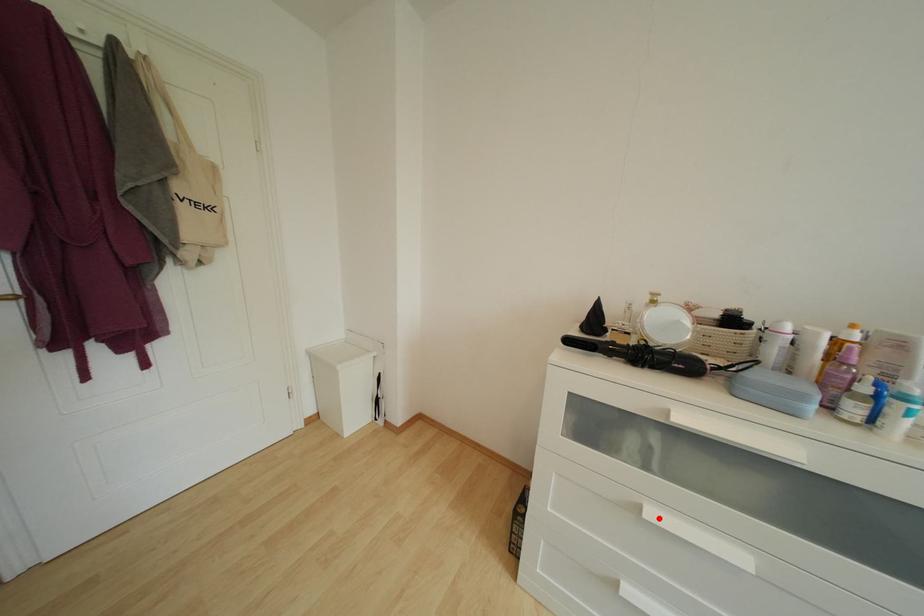
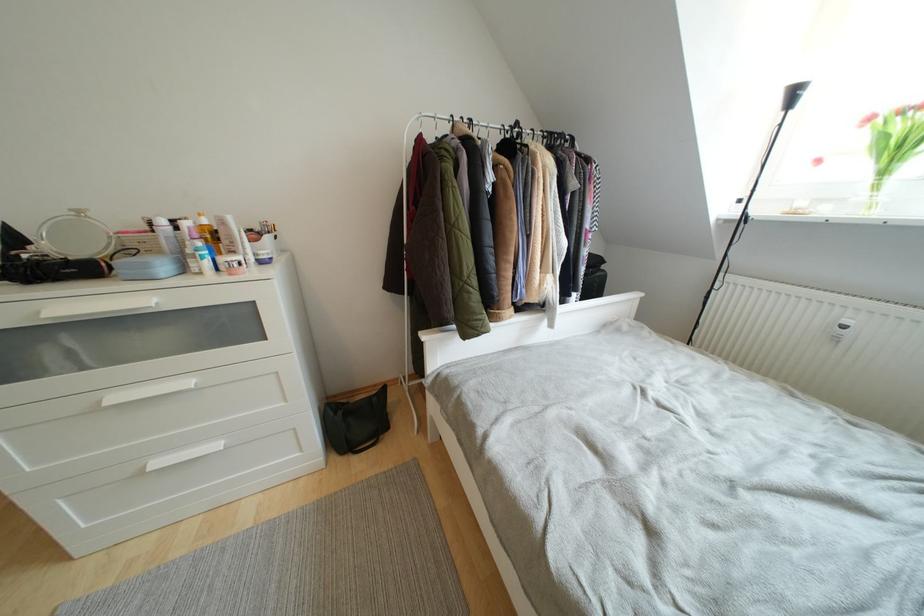
The point at the highlighted location is marked in the first image. Where is the corresponding point in the second image?

(120, 402)